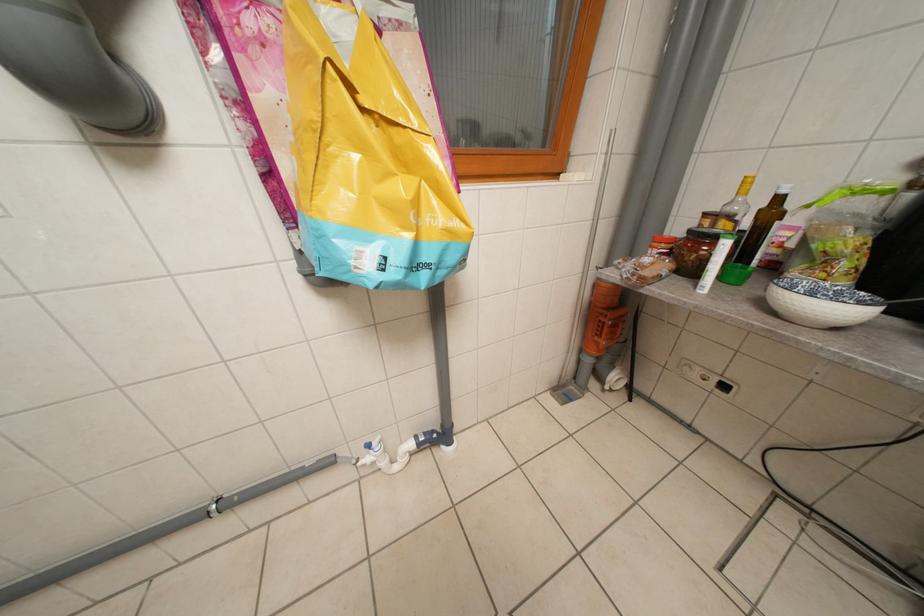
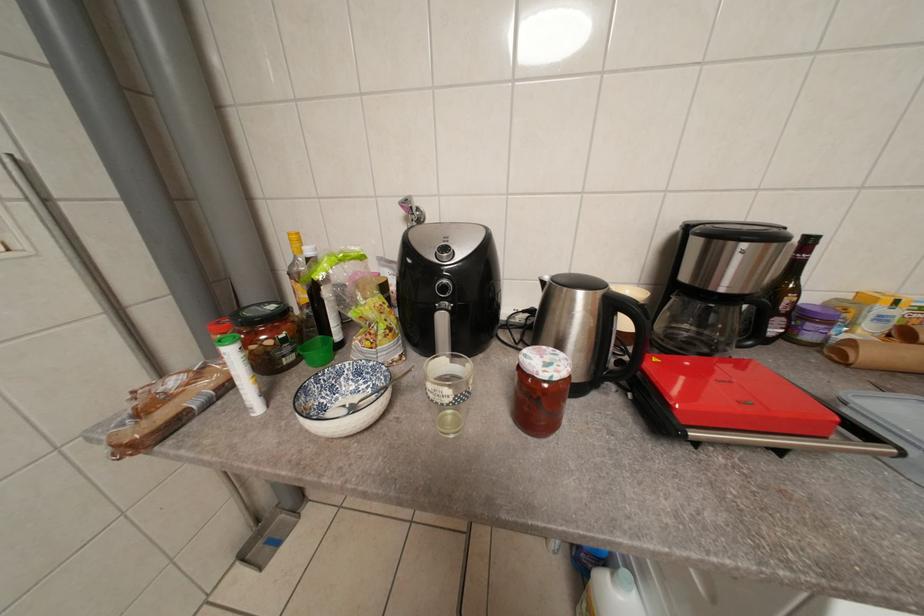
Question: The camera is either moving clockwise (left) or counter-clockwise (right) around the object. The first image is from the beginning of the video and the second image is from the end. Is the camera moving left or right when shooting the video?

Choices:
 (A) Left
 (B) Right

Answer: (A)